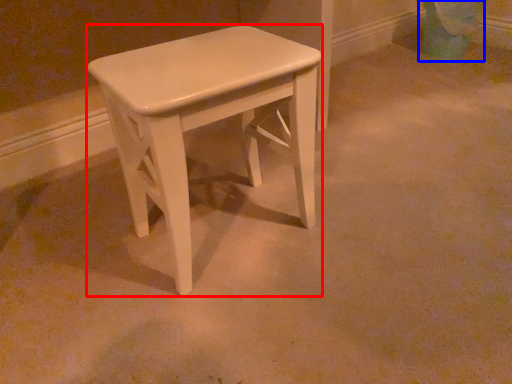
Question: Which of the following is the farthest to the observer, stool (highlighted by a red box) or swivel chair (highlighted by a blue box)?

Choices:
 (A) stool
 (B) swivel chair

Answer: (B)